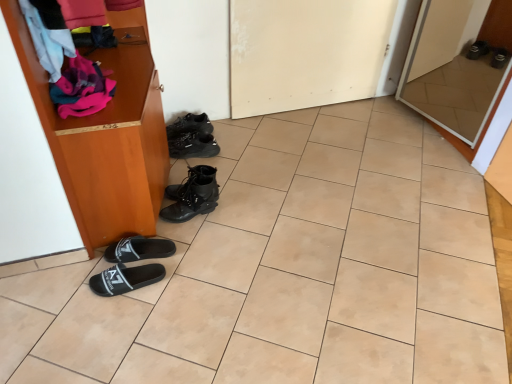
Question: In terms of width, does black leather sneakers at center, positioned as the 5th footwear in bottom-to-top order, look wider or thinner when compared to white glossy door at upper right, positioned as the 2th door in left-to-right order?

Choices:
 (A) thin
 (B) wide

Answer: (B)

Question: In terms of height, does black leather sneakers at center, which is the 1th footwear from back to front, look taller or shorter compared to white glossy door at upper right, the 1th door in the right-to-left sequence?

Choices:
 (A) short
 (B) tall

Answer: (A)

Question: Considering the real-world distances, which object is farthest from the black leather sneakers at center, the second footwear in the back-to-front sequence?

Choices:
 (A) white glossy door at upper right, positioned as the 2th door in left-to-right order
 (B) white matte door at center, the second door positioned from the right
 (C) black fabric slipper at lower left, which is the 5th footwear in top-to-bottom order
 (D) black leather boots at center, arranged as the 3th footwear when viewed from the front
 (E) matte pink fabric at left

Answer: (A)

Question: Which of these objects is positioned farthest from the matte pink fabric at left?

Choices:
 (A) white matte door at center, the second door positioned from the right
 (B) black fabric slipper at lower left, the 4th footwear from the top
 (C) white glossy door at upper right, the 1th door in the right-to-left sequence
 (D) beige tile at center
 (E) black leather sneakers at center, positioned as the 5th footwear in bottom-to-top order

Answer: (C)